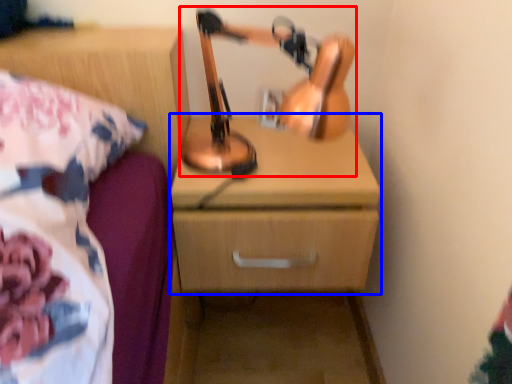
Question: Which point is closer to the camera, table lamp (highlighted by a red box) or chest of drawers (highlighted by a blue box)?

Choices:
 (A) table lamp
 (B) chest of drawers

Answer: (A)